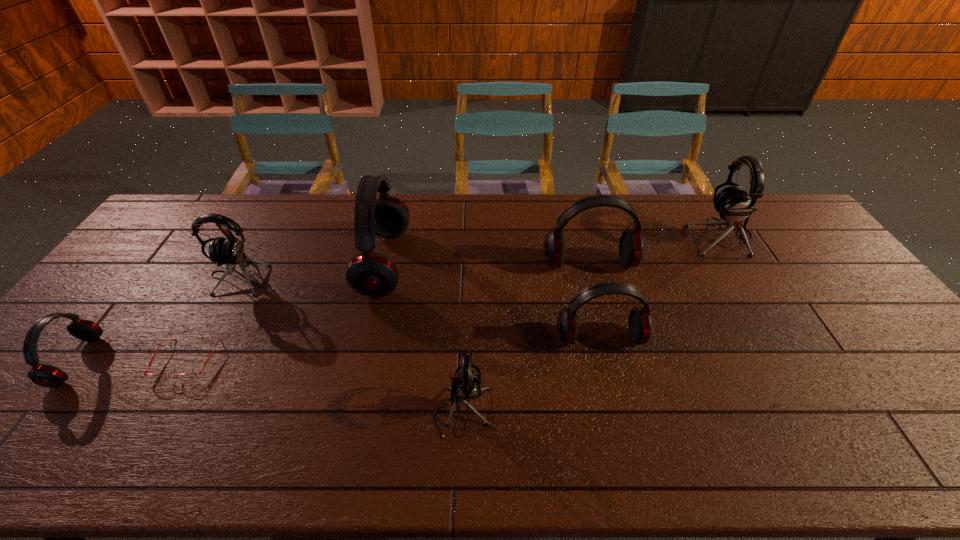
You are a GUI agent. You are given a task and a screenshot of the screen. Output one action in this format:
    pyautogui.click(x=<x>, y=<y>)
    Task: Click on the shortest earphone
    The height and width of the screenshot is (540, 960).
    Given the screenshot: What is the action you would take?
    pyautogui.click(x=44, y=375)

Where is `the smallest red earphone`? The height and width of the screenshot is (540, 960). the smallest red earphone is located at coordinates (44, 375).

Locate an element on the screen. The height and width of the screenshot is (540, 960). the shortest object is located at coordinates (182, 377).

Find the location of a particular element. This screenshot has height=540, width=960. spectacles is located at coordinates (182, 377).

This screenshot has width=960, height=540. Identify the location of vacant space located on the front of the rightmost black earphone. (775, 323).

Locate an element on the screen. The image size is (960, 540). vacant space situated on the ear cups of the biggest red earphone is located at coordinates (468, 262).

You are a GUI agent. You are given a task and a screenshot of the screen. Output one action in this format:
    pyautogui.click(x=<x>, y=<y>)
    Task: Click on the free space located 0.100m on the ear cups of the second biggest red earphone
    This screenshot has height=540, width=960.
    Given the screenshot: What is the action you would take?
    pyautogui.click(x=599, y=301)

At what (x,y) coordinates should I click in order to perform the action: click on vacant space located on the front of the sixth earphone from right to left. Please return your answer as a coordinate pair (x, y). Looking at the image, I should click on (162, 409).

The width and height of the screenshot is (960, 540). Find the location of `free space located on the ear cups of the third biggest red earphone`. free space located on the ear cups of the third biggest red earphone is located at coordinates (618, 409).

The width and height of the screenshot is (960, 540). I want to click on free space located 0.310m on the back of the smallest black earphone, so click(x=467, y=294).